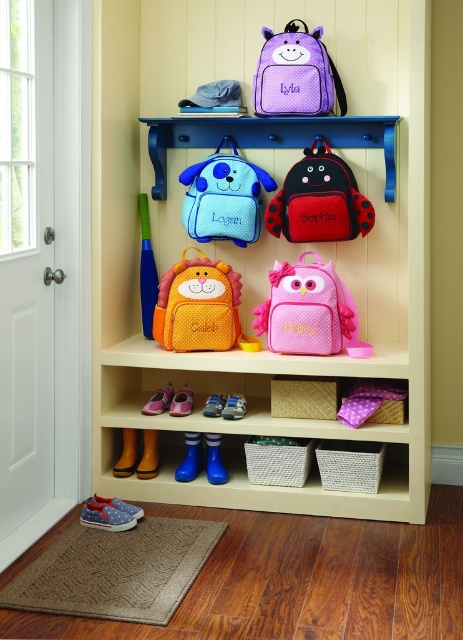
Question: Based on their relative distances, which object is farther from the matte blue backpack at upper center?

Choices:
 (A) matte plastic backpacks at upper center
 (B) pink polka dot backpack at center
 (C) blue rubber bat at upper left
 (D) orange dotted backpack at center

Answer: (B)

Question: Which object appears farthest from the camera in this image?

Choices:
 (A) orange dotted backpack at center
 (B) matte blue backpack at upper center
 (C) blue rubber bat at upper left

Answer: (C)

Question: Can you confirm if pink polka dot backpack at center is positioned above matte blue backpack at upper center?

Choices:
 (A) yes
 (B) no

Answer: (B)

Question: Can you confirm if purple dotted backpack at upper center is positioned to the right of blue rubber bat at upper left?

Choices:
 (A) no
 (B) yes

Answer: (B)

Question: Does matte plastic backpacks at upper center appear on the left side of blue rubber bat at upper left?

Choices:
 (A) no
 (B) yes

Answer: (A)

Question: Which object appears farthest from the camera in this image?

Choices:
 (A) red fabric backpack at center
 (B) orange dotted backpack at center
 (C) pink polka dot backpack at center
 (D) matte blue backpack at upper center

Answer: (D)